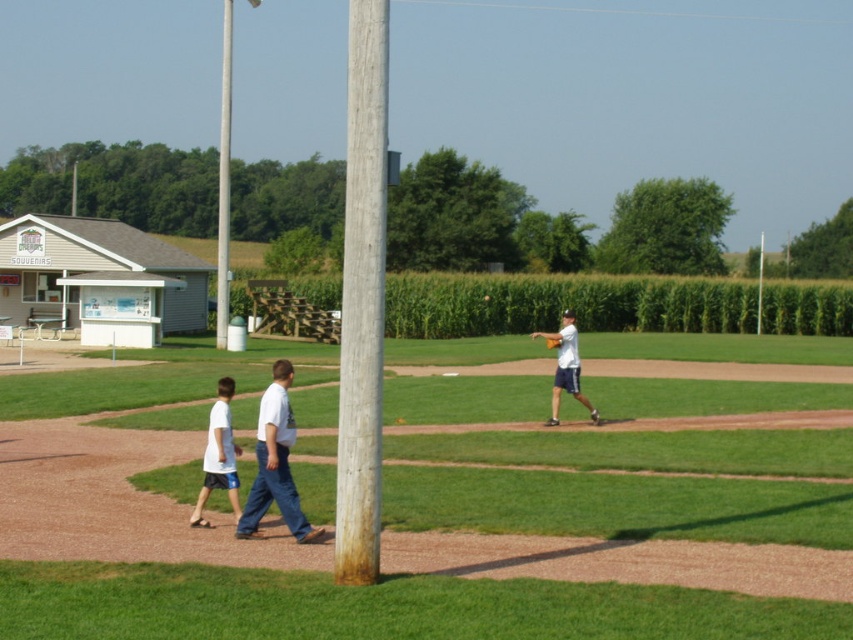
You are standing at the point labeled point (241, 538) and want to walk to point (758, 298). Which direction should you move to get closer to your destination?

You should move away from the camera because point (241, 538) is closer to the camera than point (758, 298).

You are standing at the edge of the baseball field and see the smooth gray pole at center and the white wood pole at center. Which pole is closer to the left side of the field?

The smooth gray pole at center is to the left of the white wood pole at center, so it is closer to the left side of the field.

You are standing at the edge of the baseball field and see the smooth gray pole at center and the white wood pole at center. Which pole is nearer to you?

The smooth gray pole at center is closer to the viewer than the white wood pole at center, so the smooth gray pole at center is nearer to you.